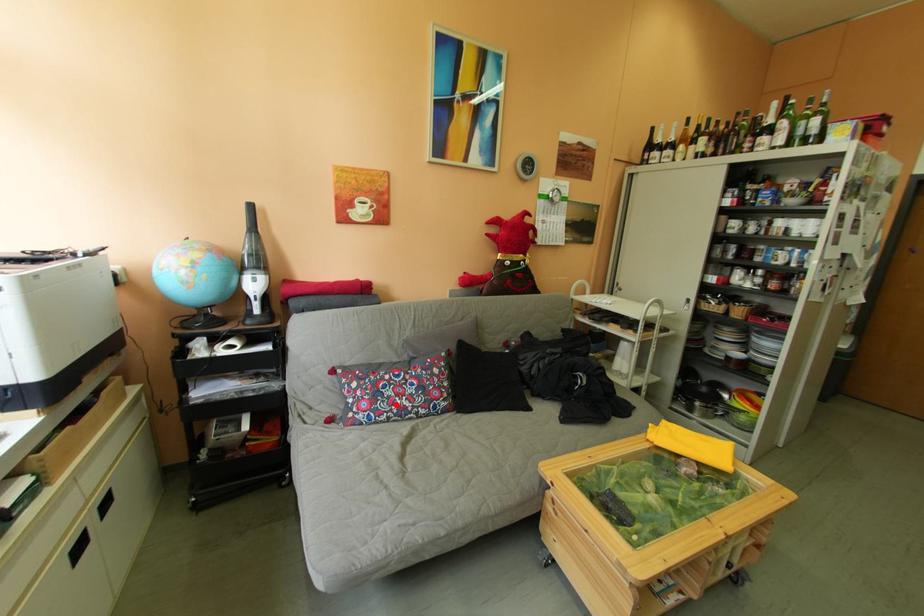
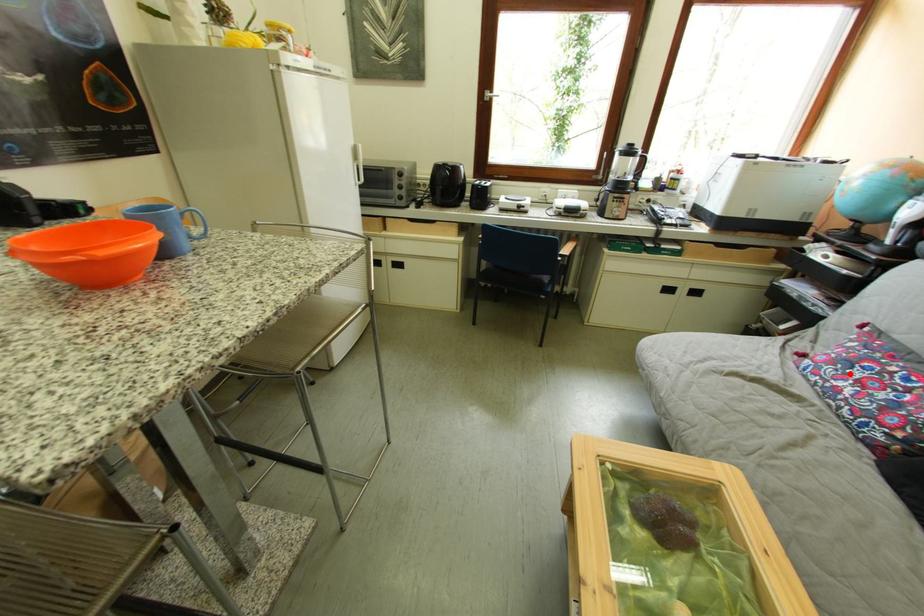
I am providing you with two images of the same scene from different viewpoints. A red point is marked on the first image and another point is marked on the second image. Is the red point in image1 aligned with the point shown in image2?

Yes